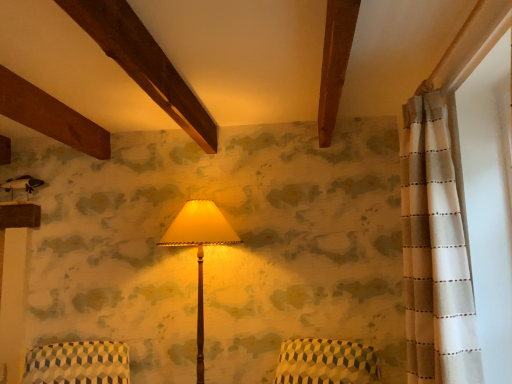
Question: Is white dotted fabric at right positioned with its back to patterned fabric armchair at lower left?

Choices:
 (A) no
 (B) yes

Answer: (A)

Question: Does white dotted fabric at right lie in front of patterned fabric armchair at lower left?

Choices:
 (A) no
 (B) yes

Answer: (B)

Question: Is white dotted fabric at right shorter than patterned fabric armchair at lower left?

Choices:
 (A) no
 (B) yes

Answer: (A)

Question: From a real-world perspective, is white dotted fabric at right over patterned fabric armchair at lower left?

Choices:
 (A) yes
 (B) no

Answer: (A)

Question: From the image's perspective, is white dotted fabric at right below patterned fabric armchair at lower left?

Choices:
 (A) yes
 (B) no

Answer: (B)

Question: Considering the positions of patterned fabric armchair at lower left and white dotted fabric at right in the image, is patterned fabric armchair at lower left taller or shorter than white dotted fabric at right?

Choices:
 (A) short
 (B) tall

Answer: (A)

Question: Looking at the image, does patterned fabric armchair at lower left seem bigger or smaller compared to white dotted fabric at right?

Choices:
 (A) small
 (B) big

Answer: (B)

Question: Would you say patterned fabric armchair at lower left is inside or outside white dotted fabric at right?

Choices:
 (A) inside
 (B) outside

Answer: (B)

Question: Considering the positions of patterned fabric armchair at lower left and white dotted fabric at right in the image, is patterned fabric armchair at lower left wider or thinner than white dotted fabric at right?

Choices:
 (A) thin
 (B) wide

Answer: (B)

Question: In the image, is wooden floor lamp at center positioned in front of or behind white dotted fabric at right?

Choices:
 (A) behind
 (B) front

Answer: (A)

Question: Is wooden floor lamp at center bigger or smaller than white dotted fabric at right?

Choices:
 (A) small
 (B) big

Answer: (B)

Question: From a real-world perspective, is wooden floor lamp at center above or below white dotted fabric at right?

Choices:
 (A) below
 (B) above

Answer: (A)

Question: Considering the positions of wooden floor lamp at center and white dotted fabric at right in the image, is wooden floor lamp at center taller or shorter than white dotted fabric at right?

Choices:
 (A) tall
 (B) short

Answer: (A)

Question: From a real-world perspective, is patterned fabric armchair at lower left physically located above or below wooden floor lamp at center?

Choices:
 (A) below
 (B) above

Answer: (A)

Question: From the image's perspective, is patterned fabric armchair at lower left located above or below wooden floor lamp at center?

Choices:
 (A) above
 (B) below

Answer: (B)